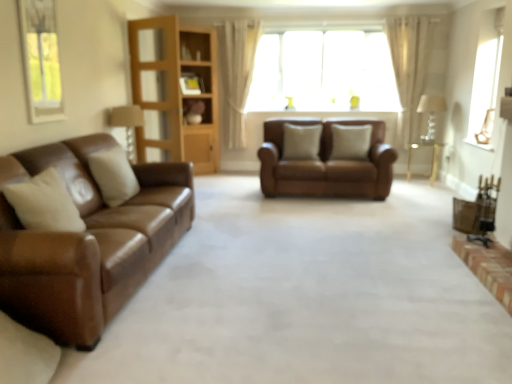
Question: Which direction should I rotate to look at beige fabric pillow at center, which ranks as the 3th pillow in front-to-back order?

Choices:
 (A) left
 (B) right

Answer: (B)

Question: Is metallic gold chair at lower right to the right of beige leather pillow at left, placed as the third pillow when sorted from right to left, from the viewer's perspective?

Choices:
 (A) no
 (B) yes

Answer: (B)

Question: Is metallic gold chair at lower right closer to the viewer compared to beige leather pillow at left, which appears as the third pillow when viewed from the back?

Choices:
 (A) yes
 (B) no

Answer: (B)

Question: Is metallic gold chair at lower right looking in the opposite direction of beige leather pillow at left, which appears as the third pillow when viewed from the back?

Choices:
 (A) yes
 (B) no

Answer: (B)

Question: Is metallic gold chair at lower right not close to beige leather pillow at left, placed as the third pillow when sorted from right to left?

Choices:
 (A) no
 (B) yes

Answer: (B)

Question: Considering the relative positions of metallic gold chair at lower right and beige leather pillow at left, the first pillow when ordered from front to back, in the image provided, is metallic gold chair at lower right to the left of beige leather pillow at left, the first pillow when ordered from front to back, from the viewer's perspective?

Choices:
 (A) yes
 (B) no

Answer: (B)

Question: Does metallic gold chair at lower right lie behind beige leather pillow at left, placed as the third pillow when sorted from right to left?

Choices:
 (A) no
 (B) yes

Answer: (B)

Question: From the image's perspective, is beige fabric curtain at upper center, the second curtain in the left-to-right sequence, located beneath gold metallic table at right?

Choices:
 (A) yes
 (B) no

Answer: (B)

Question: Could you tell me if beige fabric curtain at upper center, the 1th curtain when ordered from right to left, is facing gold metallic table at right?

Choices:
 (A) yes
 (B) no

Answer: (A)

Question: Considering the relative sizes of beige fabric curtain at upper center, the second curtain in the left-to-right sequence, and gold metallic table at right in the image provided, is beige fabric curtain at upper center, the second curtain in the left-to-right sequence, bigger than gold metallic table at right?

Choices:
 (A) yes
 (B) no

Answer: (A)

Question: Is beige fabric curtain at upper center, the 1th curtain when ordered from right to left, smaller than gold metallic table at right?

Choices:
 (A) yes
 (B) no

Answer: (B)

Question: From a real-world perspective, is beige fabric curtain at upper center, the second curtain in the left-to-right sequence, beneath gold metallic table at right?

Choices:
 (A) no
 (B) yes

Answer: (A)

Question: From the image's perspective, is beige fabric curtain at upper center, the 1th curtain when ordered from right to left, on gold metallic table at right?

Choices:
 (A) yes
 (B) no

Answer: (A)

Question: Is metallic gold chair at lower right not close to white sheer curtain at upper center, arranged as the 2th curtain when viewed from the right?

Choices:
 (A) yes
 (B) no

Answer: (A)